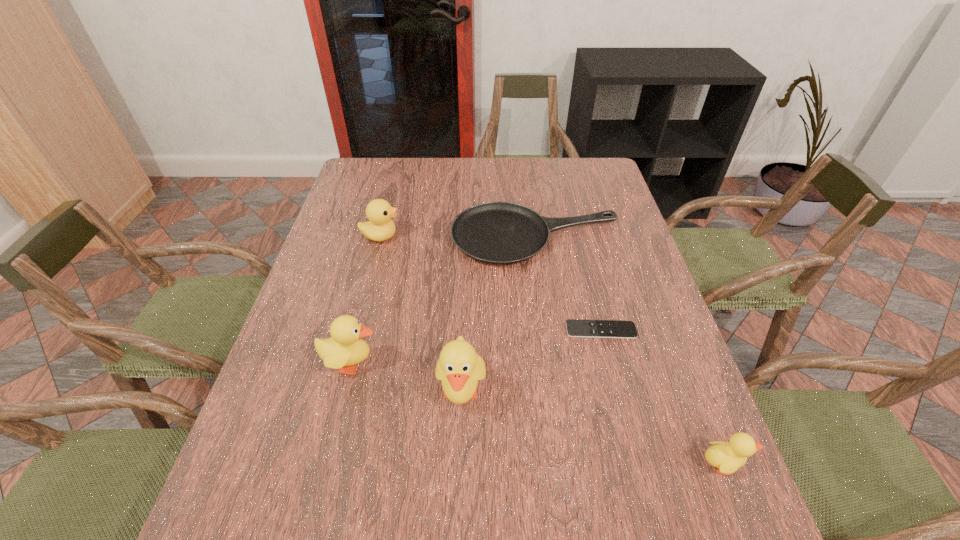
The image size is (960, 540). Identify the location of object located at the near right corner. (727, 457).

In the image, there is a desktop. At what (x,y) coordinates should I click in order to perform the action: click on free space at the far edge. Please return your answer as a coordinate pair (x, y). Looking at the image, I should click on (440, 191).

Identify the location of vacant position at the near edge of the desktop. This screenshot has width=960, height=540. (606, 459).

Where is `vacant space at the left edge`? This screenshot has height=540, width=960. vacant space at the left edge is located at coordinates (302, 343).

Image resolution: width=960 pixels, height=540 pixels. Identify the location of blank space at the right edge of the desktop. (616, 318).

In the image, there is a desktop. In order to click on vacant space at the far left corner in this screenshot , I will do `click(396, 168)`.

You are a GUI agent. You are given a task and a screenshot of the screen. Output one action in this format:
    pyautogui.click(x=<x>, y=<y>)
    Task: Click on the vacant space at the far right corner of the desktop
    This screenshot has height=540, width=960.
    Given the screenshot: What is the action you would take?
    pyautogui.click(x=579, y=191)

I want to click on free space between the remote control and the leftmost duckling, so click(476, 347).

Where is `free point between the shortest duckling and the second duckling from right to left`? free point between the shortest duckling and the second duckling from right to left is located at coordinates (591, 428).

Where is `vacant region between the second shortest duckling and the shortest duckling`? Image resolution: width=960 pixels, height=540 pixels. vacant region between the second shortest duckling and the shortest duckling is located at coordinates (537, 414).